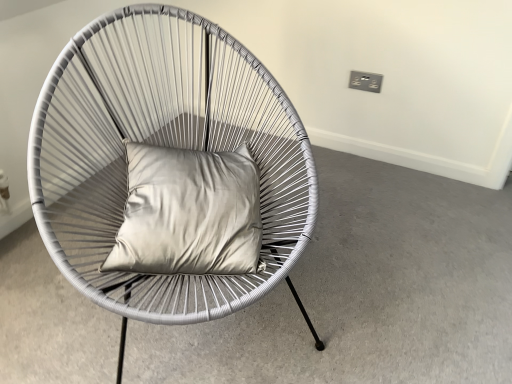
Question: Can you confirm if matte white chair at center is taller than white woven chair at center?

Choices:
 (A) no
 (B) yes

Answer: (A)

Question: Can you confirm if matte white chair at center is bigger than white woven chair at center?

Choices:
 (A) yes
 (B) no

Answer: (B)

Question: Does matte white chair at center have a smaller size compared to white woven chair at center?

Choices:
 (A) no
 (B) yes

Answer: (B)

Question: Is matte white chair at center shorter than white woven chair at center?

Choices:
 (A) yes
 (B) no

Answer: (A)

Question: From the image's perspective, is matte white chair at center on white woven chair at center?

Choices:
 (A) yes
 (B) no

Answer: (B)

Question: Which is correct: satin silver pillow at center is inside white woven chair at center, or outside of it?

Choices:
 (A) inside
 (B) outside

Answer: (A)

Question: From the image's perspective, relative to white woven chair at center, is satin silver pillow at center above or below?

Choices:
 (A) above
 (B) below

Answer: (B)

Question: From a real-world perspective, is satin silver pillow at center physically located above or below white woven chair at center?

Choices:
 (A) above
 (B) below

Answer: (A)

Question: Is satin silver pillow at center to the left or to the right of white woven chair at center in the image?

Choices:
 (A) left
 (B) right

Answer: (B)

Question: Considering the positions of satin silver pillow at center and matte white chair at center in the image, is satin silver pillow at center taller or shorter than matte white chair at center?

Choices:
 (A) tall
 (B) short

Answer: (A)

Question: Considering the positions of point (177, 243) and point (437, 206), is point (177, 243) closer or farther from the camera than point (437, 206)?

Choices:
 (A) closer
 (B) farther

Answer: (A)

Question: From a real-world perspective, is satin silver pillow at center above or below matte white chair at center?

Choices:
 (A) below
 (B) above

Answer: (B)

Question: In terms of width, does satin silver pillow at center look wider or thinner when compared to matte white chair at center?

Choices:
 (A) thin
 (B) wide

Answer: (A)

Question: From the image's perspective, relative to matte white chair at center, is white woven chair at center above or below?

Choices:
 (A) above
 (B) below

Answer: (A)

Question: Is white woven chair at center inside or outside of matte white chair at center?

Choices:
 (A) outside
 (B) inside

Answer: (A)